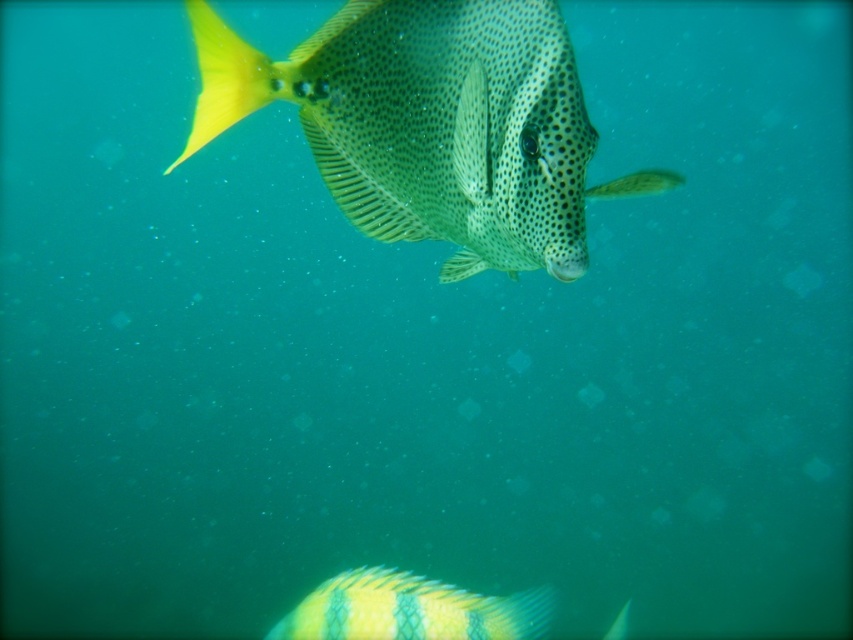
Question: Among these points, which one is nearest to the camera?

Choices:
 (A) (296, 616)
 (B) (479, 0)
 (C) (204, 8)

Answer: (B)

Question: Can you confirm if yellow-green striped fish at lower center is positioned below yellow matte fin at upper left?

Choices:
 (A) no
 (B) yes

Answer: (B)

Question: Considering the real-world distances, which object is closest to the yellow matte fin at upper left?

Choices:
 (A) spotted yellow fish at center
 (B) yellow-green striped fish at lower center

Answer: (A)

Question: Can you confirm if spotted yellow fish at center is thinner than yellow-green striped fish at lower center?

Choices:
 (A) yes
 (B) no

Answer: (A)

Question: Which of these objects is positioned farthest from the yellow-green striped fish at lower center?

Choices:
 (A) spotted yellow fish at center
 (B) yellow matte fin at upper left

Answer: (B)

Question: Considering the relative positions of yellow-green striped fish at lower center and yellow matte fin at upper left in the image provided, where is yellow-green striped fish at lower center located with respect to yellow matte fin at upper left?

Choices:
 (A) right
 (B) left

Answer: (A)